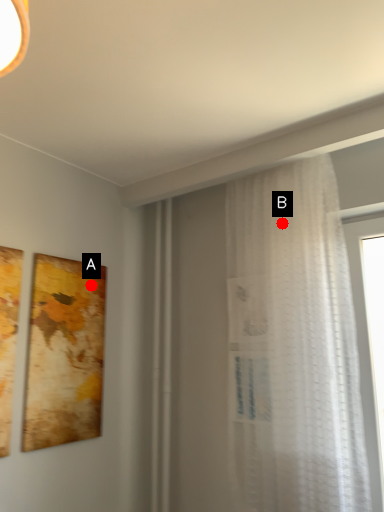
Question: Two points are circled on the image, labeled by A and B beside each circle. Which point is further to the camera?

Choices:
 (A) A is further
 (B) B is further

Answer: (A)